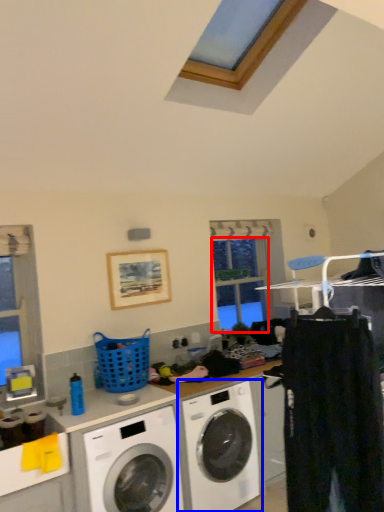
Question: Which point is closer to the camera, window screen (highlighted by a red box) or washing machine (highlighted by a blue box)?

Choices:
 (A) window screen
 (B) washing machine

Answer: (B)